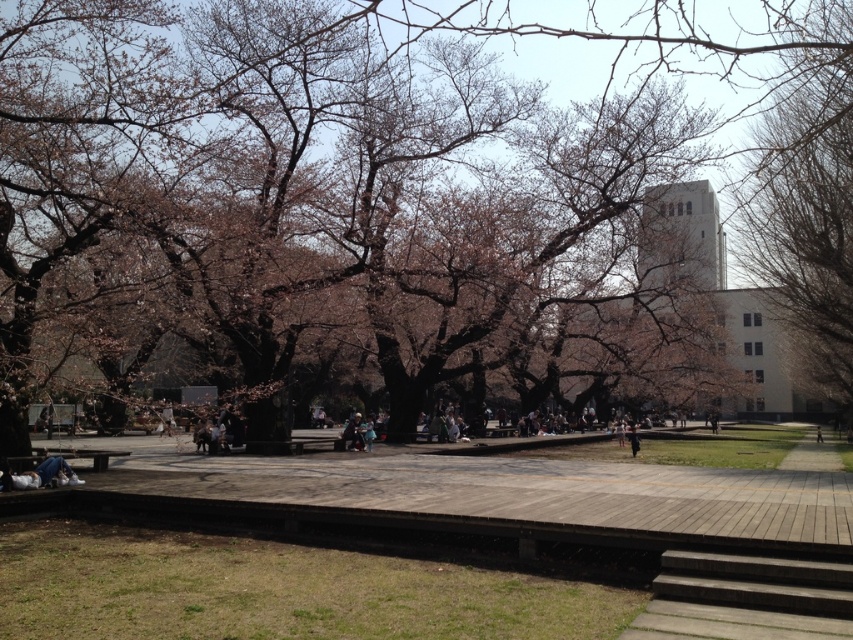
You are a photographer planning to take a photo of the pink blossoms at center and the bare branches at upper right. Which of the two objects would appear larger in the photo?

The pink blossoms at center would appear larger in the photo because they are bigger than the bare branches at upper right.

Where is the pink blossoms at center located in terms of coordinates?

The pink blossoms at center are located at coordinates point (399, 202).

You are a park visitor holding a camera. You want to take a photo that includes both the pink blossoms at center and the bare branches at upper right. Is there enough space between them to fit both in the frame?

The distance between the pink blossoms at center and the bare branches at upper right is 7.51 meters. Since most cameras can capture such a wide angle, both objects can be included in the frame.